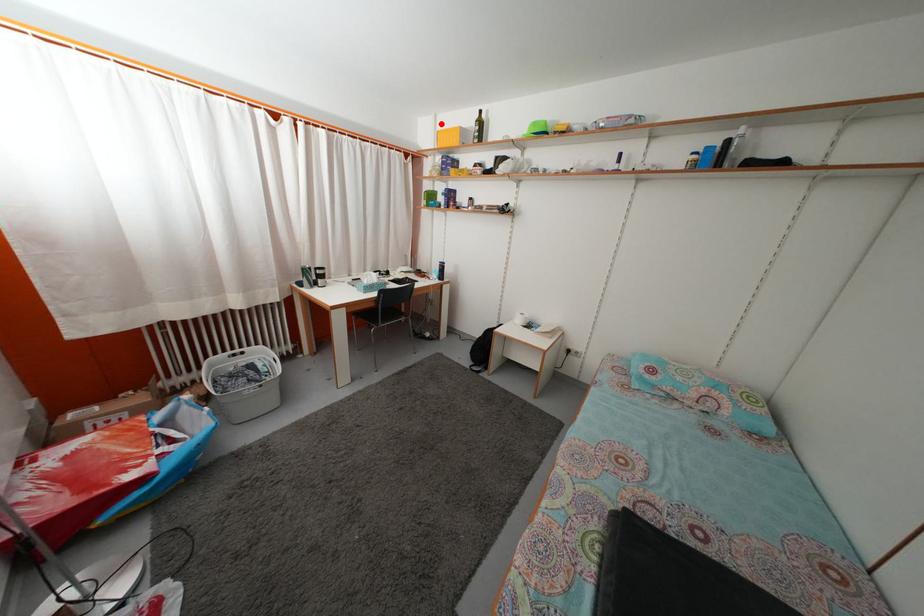
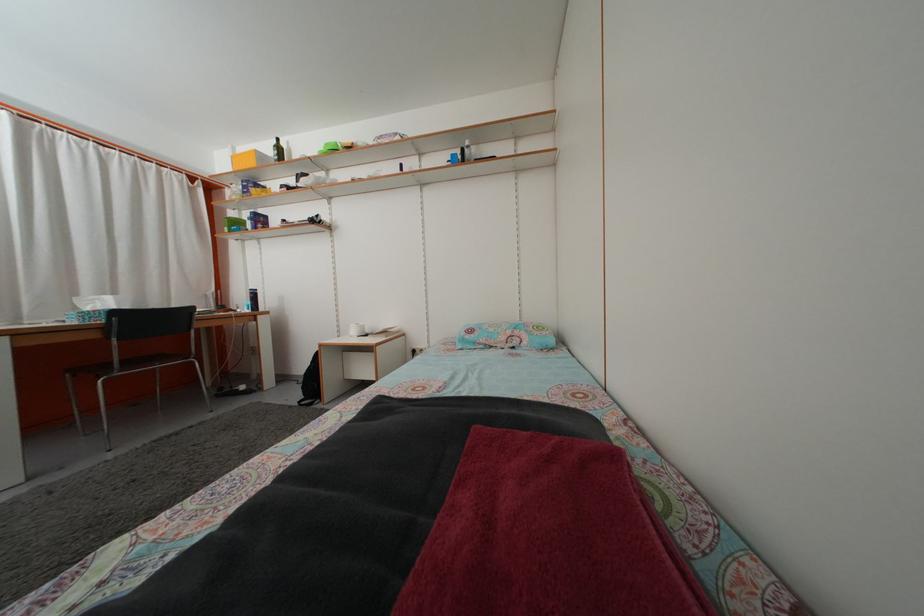
Find the pixel in the second image that matches the highlighted location in the first image.

(239, 156)